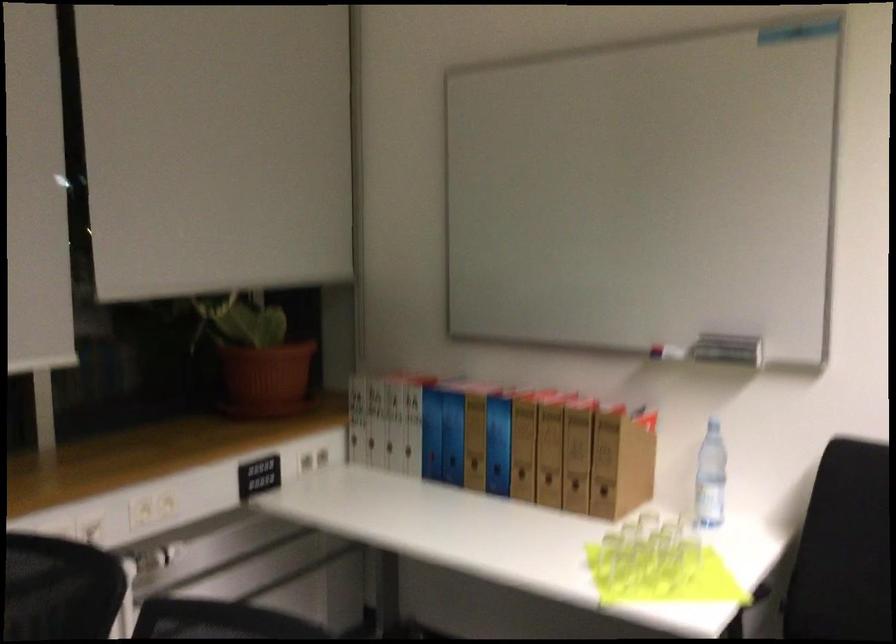
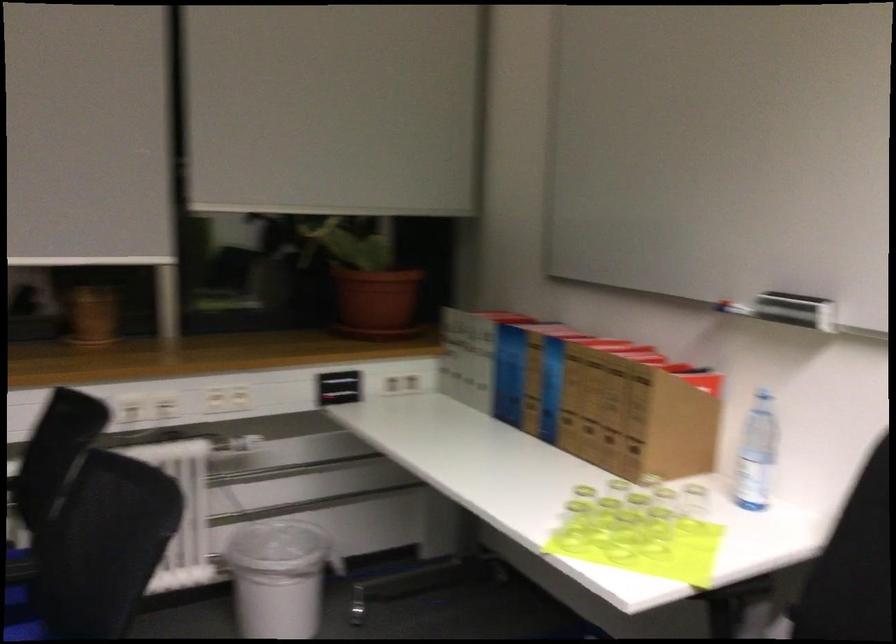
Question: The camera is either moving clockwise (left) or counter-clockwise (right) around the object. The first image is from the beginning of the video and the second image is from the end. Is the camera moving left or right when shooting the video?

Choices:
 (A) Left
 (B) Right

Answer: (B)